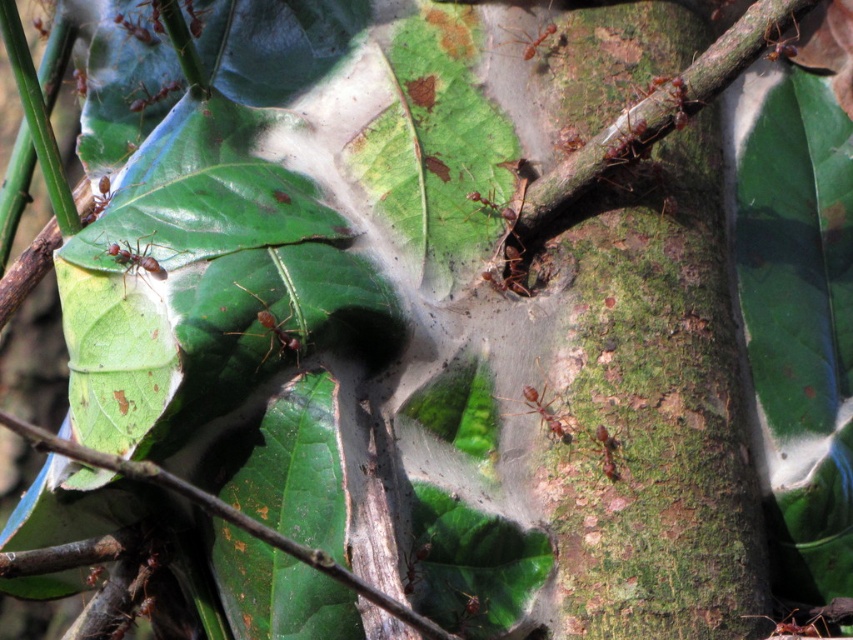
Image resolution: width=853 pixels, height=640 pixels. In order to click on shiny brown ant at center in this screenshot , I will do `click(271, 330)`.

Who is taller, shiny brown ant at center or brown matte ant at center-left?

With more height is shiny brown ant at center.

Is point (270, 328) less distant than point (161, 244)?

Yes.

At what (x,y) coordinates should I click in order to perform the action: click on shiny brown ant at center. Please return your answer as a coordinate pair (x, y). Looking at the image, I should click on (271, 330).

Which of these two, brown rough twig at center or brown matte ant at center, stands shorter?

Standing shorter between the two is brown matte ant at center.

Does brown rough twig at center come in front of brown matte ant at center?

Yes, brown rough twig at center is in front of brown matte ant at center.

This screenshot has height=640, width=853. What are the coordinates of `brown rough twig at center` in the screenshot? It's located at (224, 518).

Find the location of `brown rough twig at center`. brown rough twig at center is located at coordinates (224, 518).

Between brown rough twig at center and brown matte ant at center-left, which one has less height?

With less height is brown matte ant at center-left.

Is brown rough twig at center thinner than brown matte ant at center-left?

No.

Between point (308, 556) and point (143, 257), which one is positioned behind?

Point (143, 257)

This screenshot has height=640, width=853. Find the location of `brown rough twig at center`. brown rough twig at center is located at coordinates (224, 518).